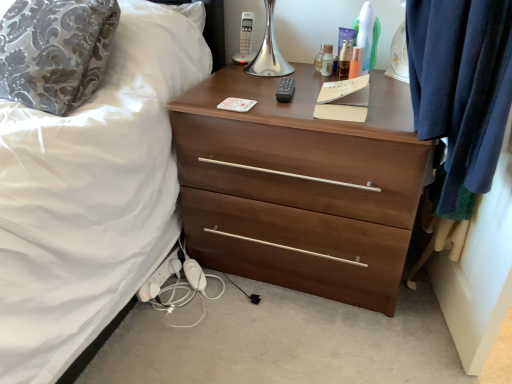
At what (x,y) coordinates should I click in order to perform the action: click on vacant space to the right of black plastic remote at center. Please return your answer as a coordinate pair (x, y). Looking at the image, I should click on pyautogui.click(x=318, y=92).